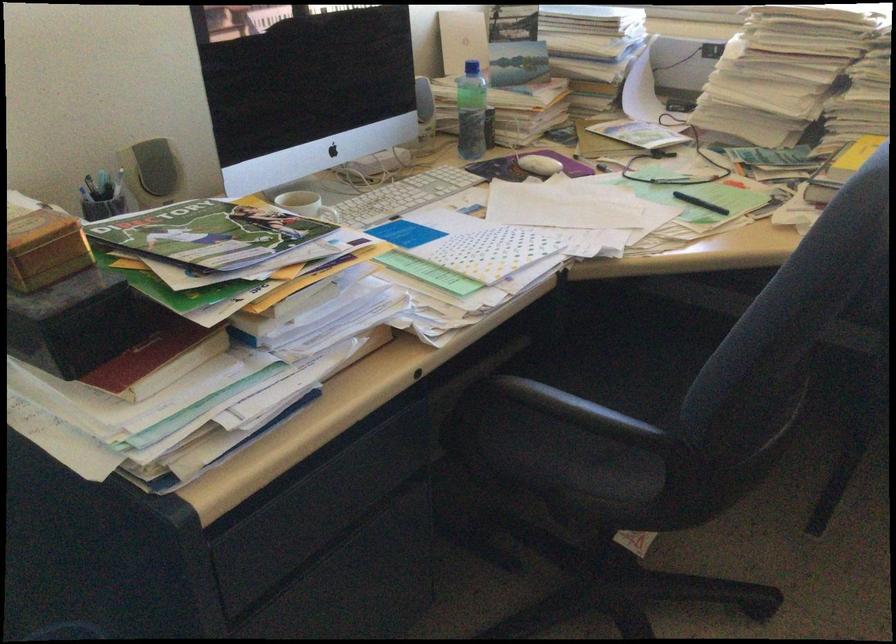
Locate an element on the screen. The width and height of the screenshot is (896, 644). small brown box is located at coordinates (42, 247).